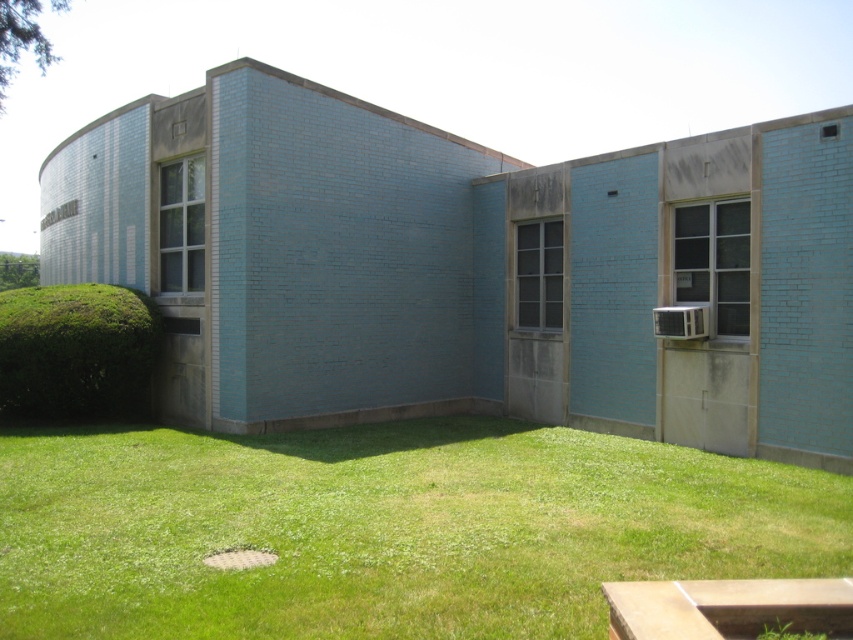
Consider the image. You are standing in front of the building and want to walk from the green leafy hedge at lower left to the green grass at lower center. Which direction should you move relative to the building?

You should move to the right relative to the building because the green grass at lower center is positioned on the right side of the green leafy hedge at lower left.

You are standing at the corner of the building and want to walk towards the green grass at lower center. What are the coordinates you need to move towards?

You need to move towards the coordinates point at (384, 529) to reach the green grass at lower center.